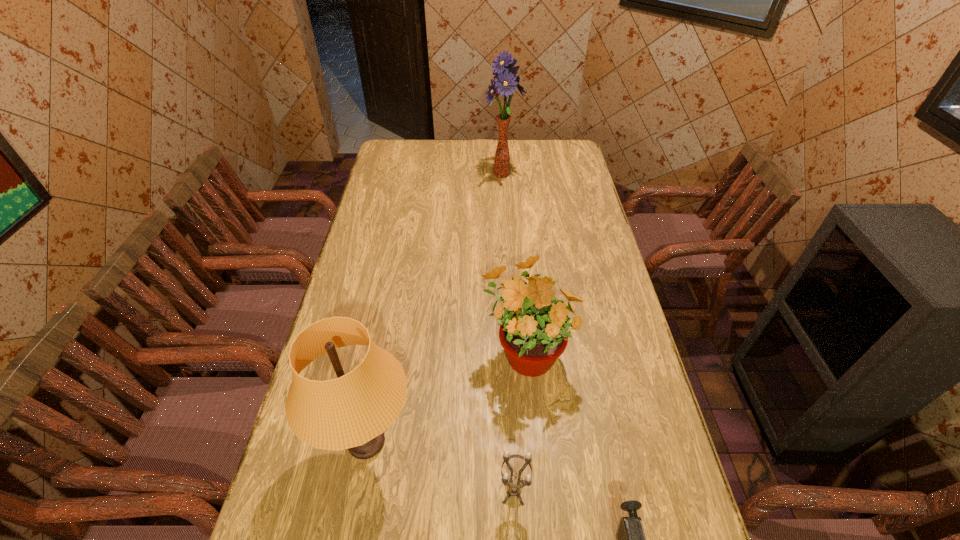
Locate an element on the screen. Image resolution: width=960 pixels, height=540 pixels. flower arrangement is located at coordinates (506, 81).

Identify the location of the tallest object. This screenshot has width=960, height=540. (506, 81).

Where is `lampshade`? The height and width of the screenshot is (540, 960). lampshade is located at coordinates (351, 412).

Identify the location of the third shortest object. (534, 329).

The image size is (960, 540). I want to click on the fourth nearest object, so click(x=534, y=329).

Where is `candle holder`? This screenshot has height=540, width=960. candle holder is located at coordinates (514, 489).

You are a GUI agent. You are given a task and a screenshot of the screen. Output one action in this format:
    pyautogui.click(x=<x>, y=<y>)
    Task: Click on the vacant region located on the front of the tallest object
    This screenshot has height=540, width=960.
    Given the screenshot: What is the action you would take?
    [506, 221]

I want to click on free space located on the right of the lampshade, so click(x=469, y=443).

What are the coordinates of `vacant space situated 0.190m on the back of the third shortest object` in the screenshot? It's located at (518, 275).

I want to click on free space located on the right of the candle holder, so click(658, 494).